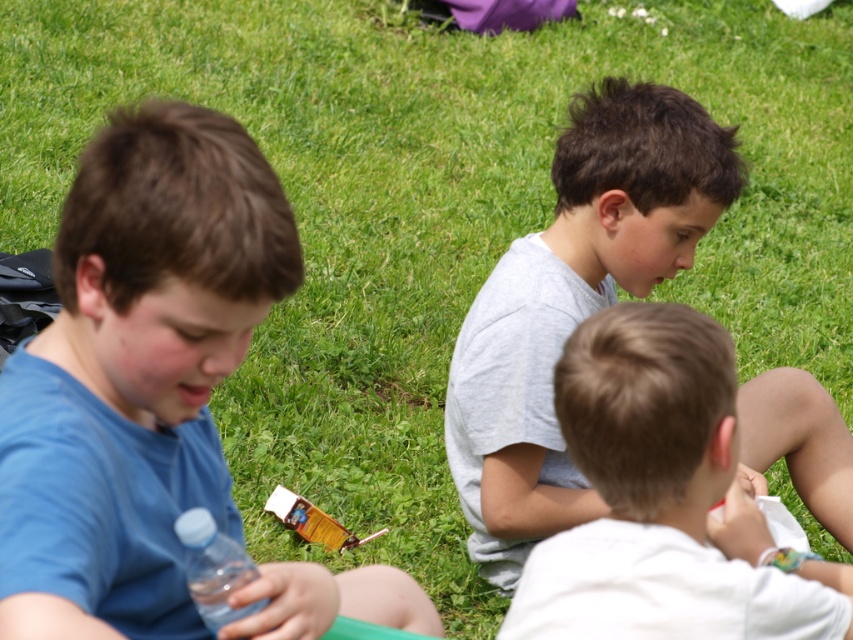
Is blue matte shirt at left taller than transparent plastic bottle at lower left?

Indeed, blue matte shirt at left has a greater height compared to transparent plastic bottle at lower left.

Which is below, blue matte shirt at left or transparent plastic bottle at lower left?

transparent plastic bottle at lower left

Who is more forward, (x=125, y=156) or (x=190, y=509)?

Point (x=125, y=156) is more forward.

Locate an element on the screen. The image size is (853, 640). blue matte shirt at left is located at coordinates (135, 372).

How distant is gray cotton shirt at center from white matte shirt at center?

They are 92.78 centimeters apart.

Find the location of a particular element. The width and height of the screenshot is (853, 640). gray cotton shirt at center is located at coordinates (573, 304).

Measure the distance from white matte shirt at center to transparent plastic bottle at lower left.

21.52 inches

Between point (820, 630) and point (218, 628), which one is positioned behind?

The point (820, 630) is behind.

From the picture: Who is more forward, (641, 586) or (221, 579)?

Point (221, 579) is more forward.

At what (x,y) coordinates should I click in order to perform the action: click on white matte shirt at center. Please return your answer as a coordinate pair (x, y). This screenshot has width=853, height=640. Looking at the image, I should click on (663, 499).